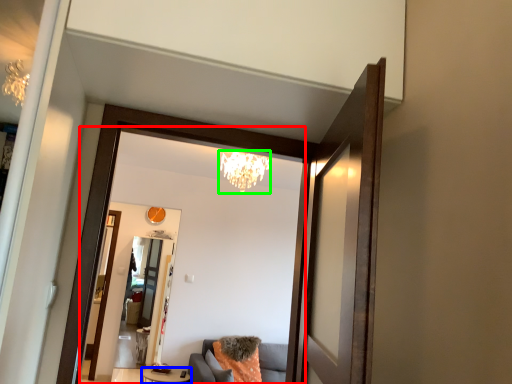
Question: Considering the real-world distances, which object is farthest from mirror (highlighted by a red box)? table (highlighted by a blue box) or light fixture (highlighted by a green box)?

Choices:
 (A) table
 (B) light fixture

Answer: (A)